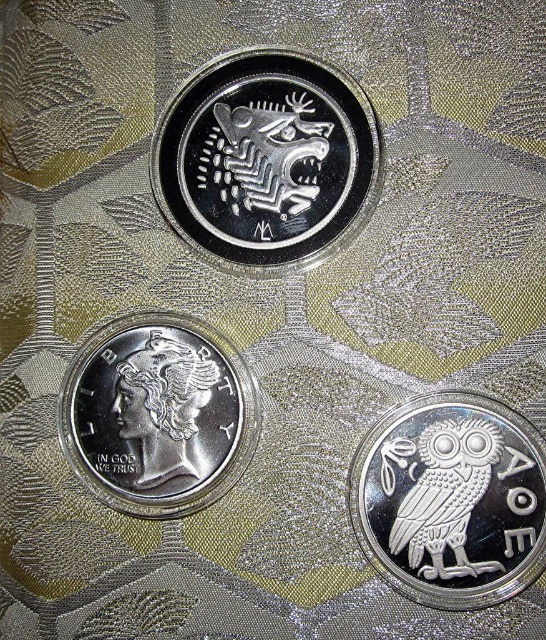
Question: Is silver/reflective/animal at upper center positioned in front of silver/smooth owl at center?

Choices:
 (A) yes
 (B) no

Answer: (B)

Question: Among these points, which one is farthest from the camera?

Choices:
 (A) [x=157, y=392]
 (B) [x=168, y=428]
 (C) [x=353, y=460]
 (D) [x=221, y=228]

Answer: (D)

Question: Which object appears farthest from the camera in this image?

Choices:
 (A) silver/smooth owl at lower right
 (B) silver/smooth owl at center
 (C) silver/metallic liberty at center
 (D) silver/reflective/animal at upper center

Answer: (D)

Question: Among these points, which one is farthest from the camera?

Choices:
 (A) (476, 461)
 (B) (247, 461)
 (C) (372, 436)
 (D) (236, 234)

Answer: (D)

Question: Does silver/reflective/animal at upper center have a lesser width compared to satin silver owl at center?

Choices:
 (A) yes
 (B) no

Answer: (B)

Question: Can you confirm if silver/reflective/animal at upper center is positioned to the right of silver/smooth owl at center?

Choices:
 (A) no
 (B) yes

Answer: (B)